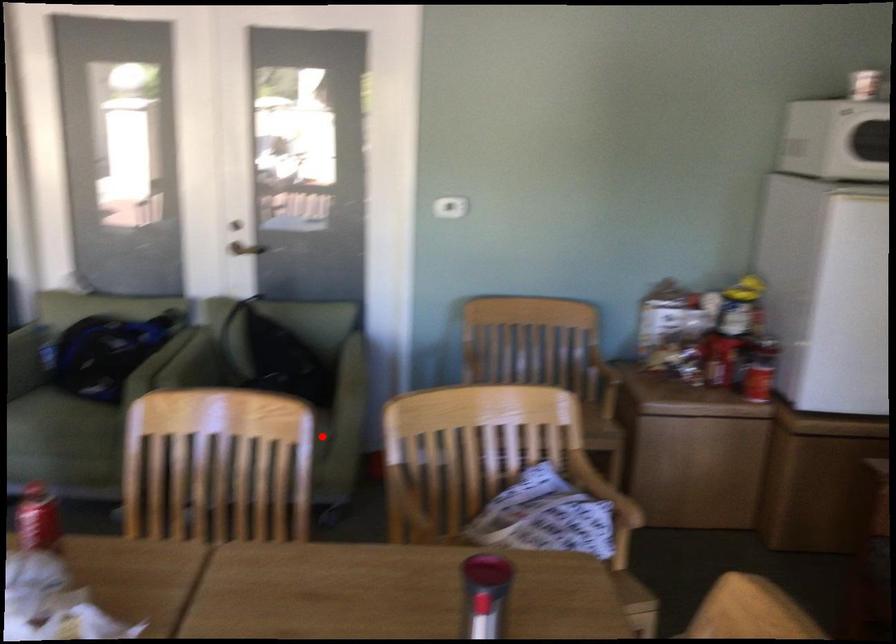
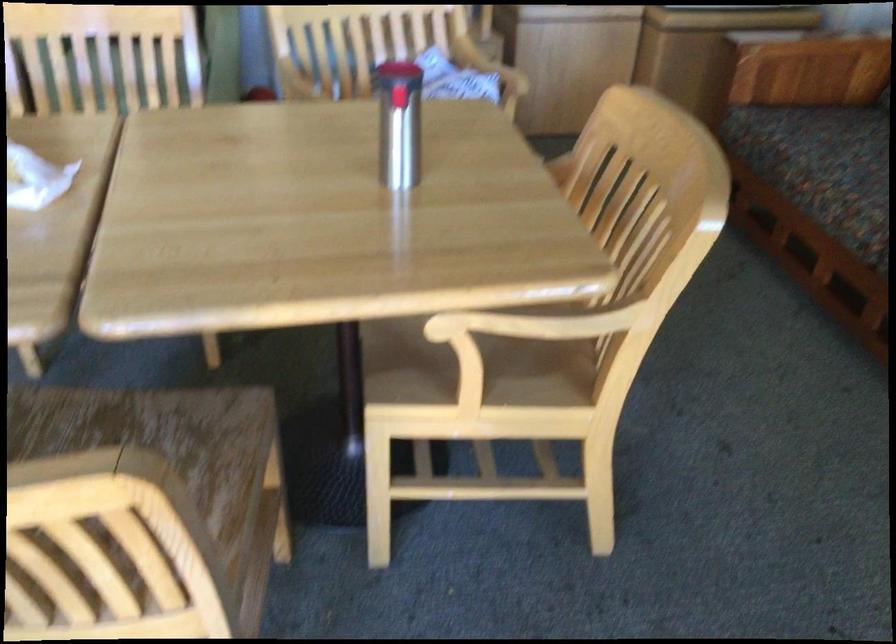
Question: I am providing you with two images of the same scene from different viewpoints. A red point is marked on the first image. At the location where the point appears in image 1, is it still visible in image 2?

Choices:
 (A) Yes
 (B) No

Answer: (B)